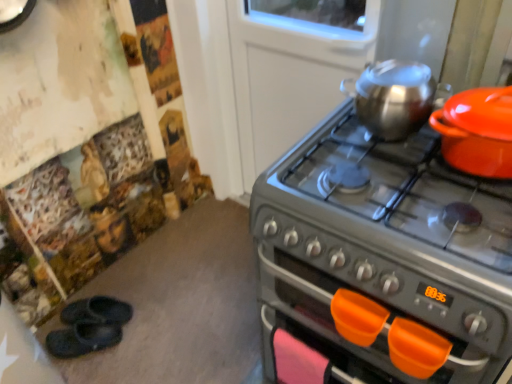
Where is `free space to the left of matte orange pot at right, positioned as the 2th kitchen appliance in left-to-right order`? This screenshot has width=512, height=384. free space to the left of matte orange pot at right, positioned as the 2th kitchen appliance in left-to-right order is located at coordinates (407, 178).